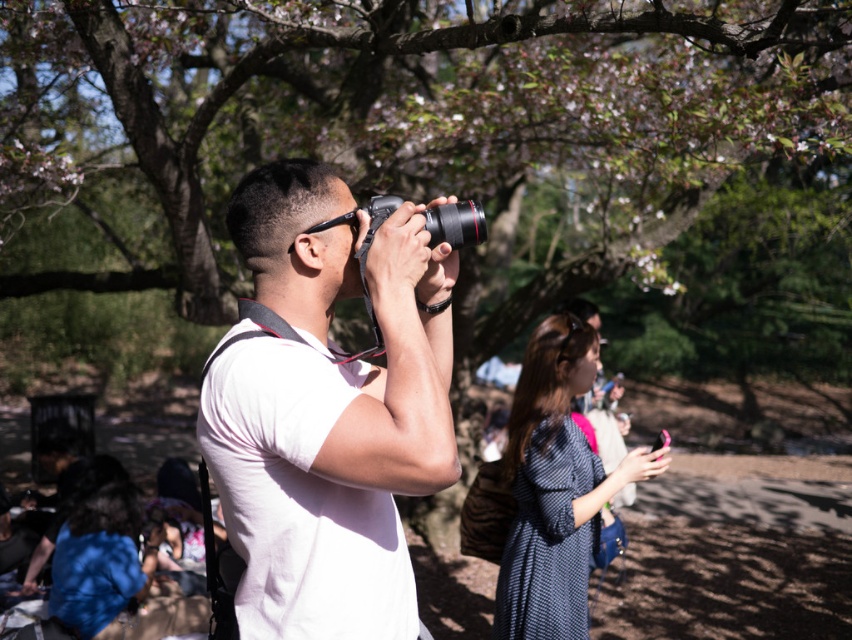
Can you confirm if white matte camera at center is positioned below dark blue textured dress at center?

No, white matte camera at center is not below dark blue textured dress at center.

This screenshot has width=852, height=640. Describe the element at coordinates (327, 412) in the screenshot. I see `white matte camera at center` at that location.

Is point (430, 413) farther from viewer compared to point (537, 547)?

No, it is in front of (537, 547).

What are the coordinates of `white matte camera at center` in the screenshot? It's located at (327, 412).

Which is above, white matte camera at center or black plastic camera at center?

black plastic camera at center is above.

Is point (327, 520) positioned in front of point (436, 212)?

Yes.

Locate an element on the screen. white matte camera at center is located at coordinates (327, 412).

Between dark blue textured dress at center and black plastic camera at center, which one is positioned lower?

dark blue textured dress at center is below.

In the scene shown: Between dark blue textured dress at center and black plastic camera at center, which one appears on the left side from the viewer's perspective?

black plastic camera at center

Which is in front, point (563, 636) or point (442, 230)?

Point (442, 230)

I want to click on dark blue textured dress at center, so click(554, 486).